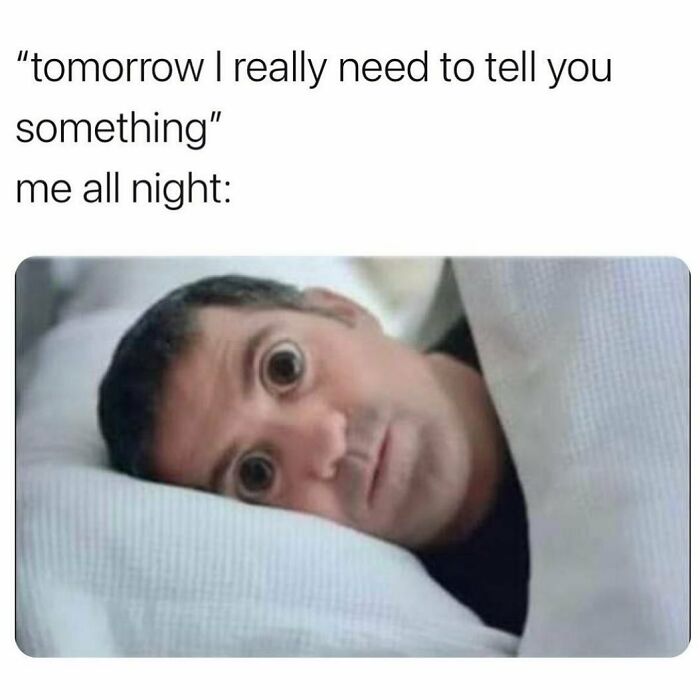
At what (x,y) coordinates should I click in order to perform the action: click on pillow. Please return your answer as a coordinate pair (x, y). The width and height of the screenshot is (700, 700). Looking at the image, I should click on (209, 584).